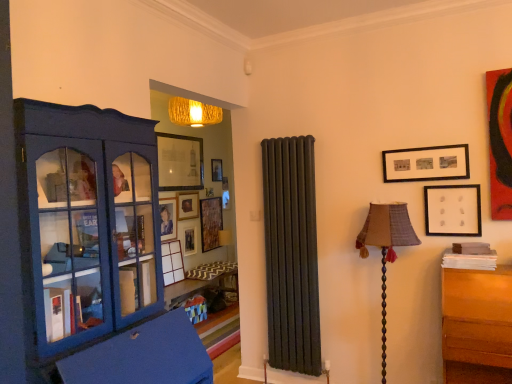
This screenshot has height=384, width=512. What do you see at coordinates (190, 241) in the screenshot?
I see `matte black picture frame at center, which is the 7th picture frame from front to back` at bounding box center [190, 241].

The image size is (512, 384). What do you see at coordinates (172, 262) in the screenshot?
I see `wooden picture frame at left, the third picture frame when ordered from left to right` at bounding box center [172, 262].

Find the location of a particular element. The image size is (512, 384). white matte picture frame at upper right, which is the 7th picture frame in back-to-front order is located at coordinates (453, 210).

The image size is (512, 384). What do you see at coordinates (453, 210) in the screenshot?
I see `white matte picture frame at upper right, the first picture frame from the front` at bounding box center [453, 210].

Where is `matte black picture frame at upper right, the 6th picture frame from the back`? matte black picture frame at upper right, the 6th picture frame from the back is located at coordinates (426, 164).

From the image's perspective, is textured fabric lampshade at right under wooden picture frame at left, the third picture frame when ordered from left to right?

No, from the image's perspective, textured fabric lampshade at right is not below wooden picture frame at left, the third picture frame when ordered from left to right.

Is textured fabric lampshade at right surrounding wooden picture frame at left, which is the fifth picture frame from right to left?

No, wooden picture frame at left, which is the fifth picture frame from right to left, is not surrounded by textured fabric lampshade at right.

From a real-world perspective, is textured fabric lampshade at right positioned over wooden picture frame at left, which ranks as the fourth picture frame in front-to-back order, based on gravity?

Yes.

Is textured fabric lampshade at right to the left of wooden picture frame at left, which ranks as the fourth picture frame in front-to-back order, from the viewer's perspective?

No, textured fabric lampshade at right is not to the left of wooden picture frame at left, which ranks as the fourth picture frame in front-to-back order.

From a real-world perspective, is wooden picture frame at left, the fourth picture frame when ordered from back to front, over matte black picture frame at center, which is the 7th picture frame from front to back?

No, from a real-world perspective, wooden picture frame at left, the fourth picture frame when ordered from back to front, is not above matte black picture frame at center, which is the 7th picture frame from front to back.

Is wooden picture frame at left, the third picture frame when ordered from left to right, outside of matte black picture frame at center, the 3th picture frame in the right-to-left sequence?

Absolutely, wooden picture frame at left, the third picture frame when ordered from left to right, is external to matte black picture frame at center, the 3th picture frame in the right-to-left sequence.

Can you tell me how much wooden picture frame at left, which is the fifth picture frame from right to left, and matte black picture frame at center, which appears as the 1th picture frame when viewed from the back, differ in facing direction?

The facing directions of wooden picture frame at left, which is the fifth picture frame from right to left, and matte black picture frame at center, which appears as the 1th picture frame when viewed from the back, are 1.65 degrees apart.

Is matte wooden picture frame at center, the 5th picture frame viewed from the front, turned away from textured fabric lampshade at right?

No, textured fabric lampshade at right is not at the back of matte wooden picture frame at center, the 5th picture frame viewed from the front.

From a real-world perspective, is matte wooden picture frame at center, positioned as the 7th picture frame in right-to-left order, physically above textured fabric lampshade at right?

Correct, in the physical world, matte wooden picture frame at center, positioned as the 7th picture frame in right-to-left order, is higher than textured fabric lampshade at right.

This screenshot has width=512, height=384. In order to click on lamp below the matte wooden picture frame at center, marked as the 1th picture frame in a left-to-right arrangement (from a real-world perspective) in this screenshot , I will do `click(386, 246)`.

Considering the points (162, 201) and (382, 343), which point is behind, point (162, 201) or point (382, 343)?

The point (162, 201) is more distant.

Which is behind, point (455, 162) or point (39, 126)?

The point (455, 162) is more distant.

Which object is positioned more to the left, matte black picture frame at upper right, the 6th picture frame when ordered from left to right, or matte blue cabinet at left?

From the viewer's perspective, matte blue cabinet at left appears more on the left side.

Considering the sizes of objects matte black picture frame at upper right, which appears as the 2th picture frame when viewed from the front, and matte blue cabinet at left in the image provided, who is taller, matte black picture frame at upper right, which appears as the 2th picture frame when viewed from the front, or matte blue cabinet at left?

matte blue cabinet at left.

Looking at their sizes, would you say matte black picture frame at upper right, the 2th picture frame when ordered from right to left, is wider or thinner than matte blue cabinet at left?

matte black picture frame at upper right, the 2th picture frame when ordered from right to left, is thinner than matte blue cabinet at left.

Would you say matte black picture frame at upper right, the 2th picture frame when ordered from right to left, is inside or outside white matte picture frame at upper right, which is the 7th picture frame in back-to-front order?

matte black picture frame at upper right, the 2th picture frame when ordered from right to left, is outside white matte picture frame at upper right, which is the 7th picture frame in back-to-front order.

From the image's perspective, starting from the matte black picture frame at upper right, which appears as the 2th picture frame when viewed from the front, which picture frame is the 1st one below? Please provide its 2D coordinates.

[(453, 210)]

Can you confirm if matte black picture frame at upper right, the 6th picture frame when ordered from left to right, is smaller than white matte picture frame at upper right, the first picture frame from the front?

Incorrect, matte black picture frame at upper right, the 6th picture frame when ordered from left to right, is not smaller in size than white matte picture frame at upper right, the first picture frame from the front.

Is matte black picture frame at upper right, the 6th picture frame from the back, not near white matte picture frame at upper right, the 7th picture frame when ordered from left to right?

They are positioned close to each other.

Does point (169, 281) come in front of point (168, 239)?

Yes, point (169, 281) is in front of point (168, 239).

Is wooden picture frame at left, which is the fifth picture frame from right to left, outside of matte wooden picture frame at center, positioned as the 3th picture frame in back-to-front order?

That's correct, wooden picture frame at left, which is the fifth picture frame from right to left, is outside of matte wooden picture frame at center, positioned as the 3th picture frame in back-to-front order.

From the image's perspective, who appears lower, wooden picture frame at left, the third picture frame when ordered from left to right, or matte wooden picture frame at center, marked as the 1th picture frame in a left-to-right arrangement?

wooden picture frame at left, the third picture frame when ordered from left to right, appears lower in the image.

Would you say wooden picture frame at left, the fourth picture frame when ordered from back to front, is to the left or to the right of matte wooden picture frame at center, positioned as the 3th picture frame in back-to-front order, in the picture?

wooden picture frame at left, the fourth picture frame when ordered from back to front, is to the right of matte wooden picture frame at center, positioned as the 3th picture frame in back-to-front order.

From the image's perspective, relative to matte wooden picture frame at center, the 5th picture frame viewed from the front, is matte glass picture frame at upper center, the sixth picture frame positioned from the right, above or below?

matte glass picture frame at upper center, the sixth picture frame positioned from the right, is above matte wooden picture frame at center, the 5th picture frame viewed from the front.

Based on the photo, which object is closer to the camera taking this photo, matte glass picture frame at upper center, which is the fifth picture frame from back to front, or matte wooden picture frame at center, the 5th picture frame viewed from the front?

Positioned in front is matte glass picture frame at upper center, which is the fifth picture frame from back to front.

Is matte glass picture frame at upper center, marked as the second picture frame in a left-to-right arrangement, far away from matte wooden picture frame at center, the 5th picture frame viewed from the front?

That's not correct — matte glass picture frame at upper center, marked as the second picture frame in a left-to-right arrangement, is a little close to matte wooden picture frame at center, the 5th picture frame viewed from the front.

This screenshot has height=384, width=512. I want to click on the 4th picture frame located above the matte wooden picture frame at center, marked as the 1th picture frame in a left-to-right arrangement (from a real-world perspective), so click(180, 162).

Find the location of `picture frame below the textured fabric lampshade at right (from the image's perspective)`. picture frame below the textured fabric lampshade at right (from the image's perspective) is located at coordinates (172, 262).

There is a wooden picture frame at left, which is the fifth picture frame from right to left. Identify the location of the 1st picture frame above it (from a real-world perspective). Image resolution: width=512 pixels, height=384 pixels. (190, 241).

Which object lies further to the anchor point matte black picture frame at upper right, which appears as the 2th picture frame when viewed from the front, matte wooden picture frame at center, positioned as the 3th picture frame in back-to-front order, or matte gold picture frame at center, placed as the second picture frame when sorted from back to front?

matte gold picture frame at center, placed as the second picture frame when sorted from back to front, lies further to matte black picture frame at upper right, which appears as the 2th picture frame when viewed from the front, than the other object.

Based on their spatial positions, is matte gold picture frame at center, placed as the fourth picture frame when sorted from left to right, or matte blue cabinet at left further from textured fabric lampshade at right?

matte gold picture frame at center, placed as the fourth picture frame when sorted from left to right.

When comparing their distances from matte black picture frame at upper right, the 6th picture frame from the back, does matte wooden picture frame at center, the 5th picture frame viewed from the front, or textured fabric lampshade at right seem further?

matte wooden picture frame at center, the 5th picture frame viewed from the front, is further to matte black picture frame at upper right, the 6th picture frame from the back.

When comparing their distances from matte black picture frame at upper right, the 6th picture frame when ordered from left to right, does matte black picture frame at center, the fifth picture frame when ordered from left to right, or matte gold picture frame at center, placed as the second picture frame when sorted from back to front, seem further?

matte gold picture frame at center, placed as the second picture frame when sorted from back to front, is further to matte black picture frame at upper right, the 6th picture frame when ordered from left to right.

From the picture: Estimate the real-world distances between objects in this image. Which object is further from matte black picture frame at upper right, which appears as the 2th picture frame when viewed from the front, wooden picture frame at left, which ranks as the fourth picture frame in front-to-back order, or matte black picture frame at center, which appears as the 1th picture frame when viewed from the back?

matte black picture frame at center, which appears as the 1th picture frame when viewed from the back, is further to matte black picture frame at upper right, which appears as the 2th picture frame when viewed from the front.

When comparing their distances from matte black picture frame at upper right, the 2th picture frame when ordered from right to left, does matte blue cabinet at left or wooden picture frame at left, the third picture frame when ordered from left to right, seem closer?

The object closer to matte black picture frame at upper right, the 2th picture frame when ordered from right to left, is matte blue cabinet at left.

Considering their positions, is wooden picture frame at left, the third picture frame when ordered from left to right, positioned further to matte blue cabinet at left than matte black picture frame at center, the fifth picture frame when ordered from left to right?

matte black picture frame at center, the fifth picture frame when ordered from left to right, lies further to matte blue cabinet at left than the other object.

Which object lies further to the anchor point wooden picture frame at left, the fourth picture frame when ordered from back to front, matte black picture frame at upper right, the 2th picture frame when ordered from right to left, or textured fabric lampshade at right?

matte black picture frame at upper right, the 2th picture frame when ordered from right to left, is further to wooden picture frame at left, the fourth picture frame when ordered from back to front.

Where is `picture frame between matte gold picture frame at center, placed as the second picture frame when sorted from back to front, and matte black picture frame at center, which is the 7th picture frame from front to back, from top to bottom`? picture frame between matte gold picture frame at center, placed as the second picture frame when sorted from back to front, and matte black picture frame at center, which is the 7th picture frame from front to back, from top to bottom is located at coordinates (168, 218).

Locate an element on the screen. The width and height of the screenshot is (512, 384). picture frame between matte black picture frame at upper right, which appears as the 2th picture frame when viewed from the front, and wooden picture frame at left, which is the fifth picture frame from right to left, in the front-back direction is located at coordinates (180, 162).

Locate an element on the screen. The width and height of the screenshot is (512, 384). picture frame between matte wooden picture frame at center, marked as the 1th picture frame in a left-to-right arrangement, and wooden picture frame at left, the third picture frame when ordered from left to right, from top to bottom is located at coordinates (190, 241).

You are a GUI agent. You are given a task and a screenshot of the screen. Output one action in this format:
    pyautogui.click(x=<x>, y=<y>)
    Task: Click on the lamp between matte blue cabinet at left and matte wooden picture frame at center, positioned as the 7th picture frame in right-to-left order, in the front-back direction
    Image resolution: width=512 pixels, height=384 pixels.
    Given the screenshot: What is the action you would take?
    pyautogui.click(x=386, y=246)